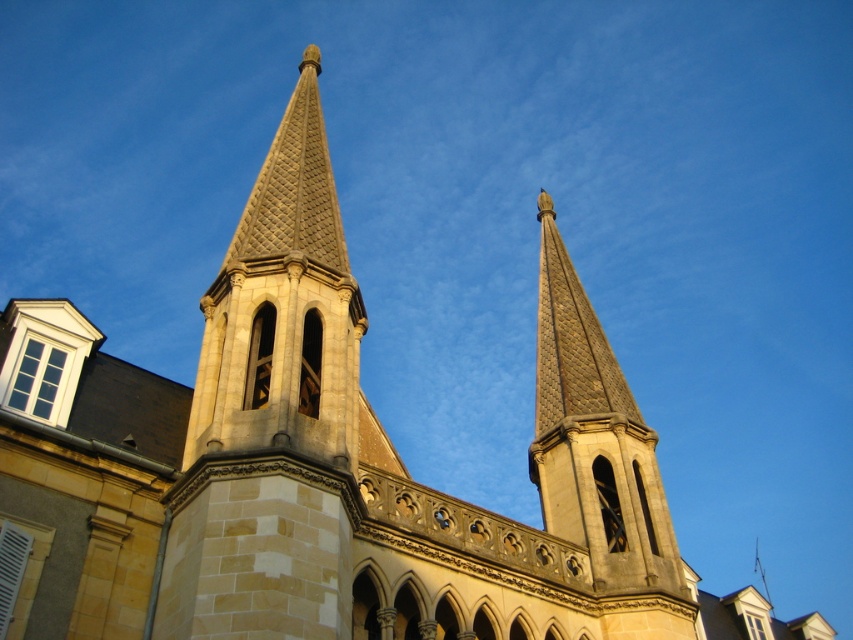
Between beige stone spire at upper center and stone spire at center, which one is positioned higher?

beige stone spire at upper center is above.

Does beige stone spire at upper center lie in front of stone spire at center?

Yes, beige stone spire at upper center is closer to the viewer.

Describe the element at coordinates (283, 308) in the screenshot. I see `beige stone spire at upper center` at that location.

This screenshot has height=640, width=853. I want to click on beige stone spire at upper center, so pyautogui.click(x=283, y=308).